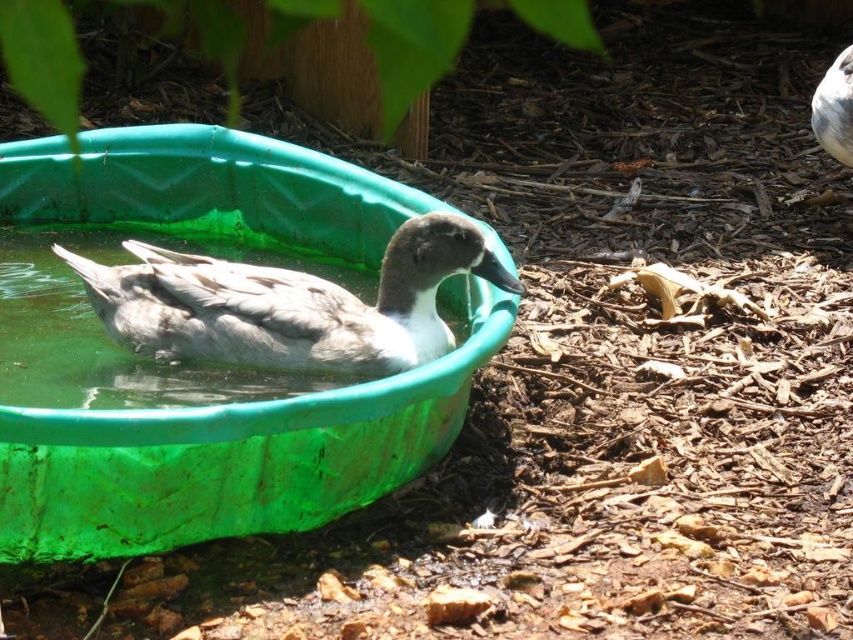
You are a child who wants to play with the gray matte duck at center in the green plastic basin at center. Can you reach the duck if you are 1 meter tall?

The green plastic basin at center has a greater height compared to gray matte duck at center. Since the basin is taller than the duck, the duck might be submerged or partially hidden inside the basin. If the basin is too tall, it might be difficult for a 1 meter tall child to reach the duck unless they can lean over the edge.

You are a child who wants to play with the gray matte duck at center in the green plastic basin at center. Can you fit both your hand and the duck inside the basin at the same time?

The green plastic basin at center has a larger size compared to gray matte duck at center, so yes, you can fit both your hand and the duck inside the basin at the same time.